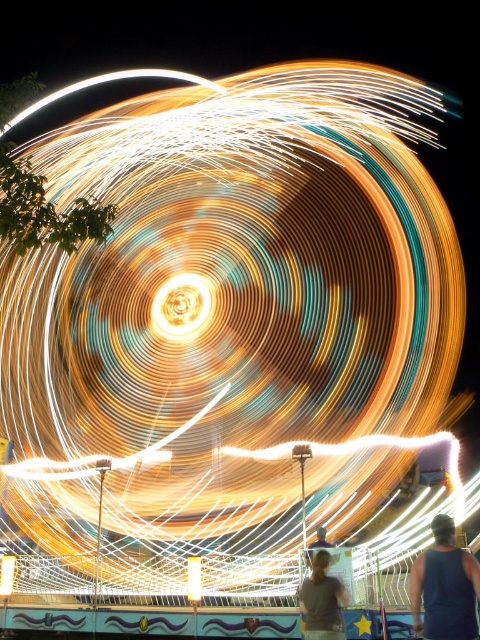
Question: Estimate the real-world distances between objects in this image. Which object is farther from the gray matte shirt at lower center?

Choices:
 (A) golden spiral at center
 (B) dark blue tank top at lower right

Answer: (A)

Question: Which is nearer to the yellow/golden metallic light at center?

Choices:
 (A) dark blue tank top at lower right
 (B) gray matte shirt at lower center
 (C) golden spiral at center

Answer: (B)

Question: Which object is closer to the camera taking this photo?

Choices:
 (A) dark blue tank top at lower right
 (B) gray matte shirt at lower center
 (C) yellow/golden metallic light at center

Answer: (A)

Question: Does dark blue tank top at lower right lie in front of gray matte shirt at lower center?

Choices:
 (A) yes
 (B) no

Answer: (A)

Question: Can you confirm if dark blue tank top at lower right is smaller than yellow/golden metallic light at center?

Choices:
 (A) no
 (B) yes

Answer: (A)

Question: Is golden spiral at center bigger than yellow/golden metallic light at center?

Choices:
 (A) yes
 (B) no

Answer: (A)